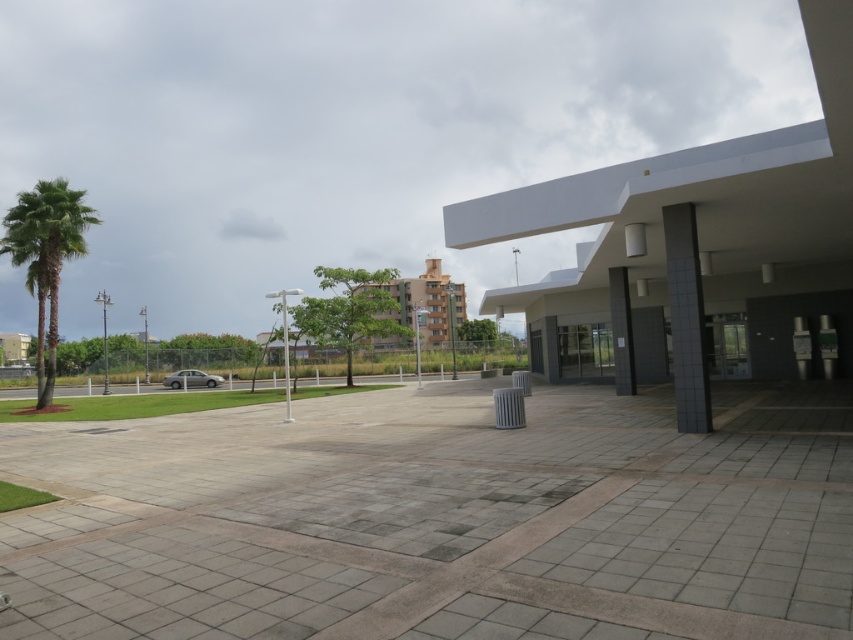
Question: Is green leafy palm tree at left thinner than black tile pillar at right?

Choices:
 (A) no
 (B) yes

Answer: (A)

Question: Which point is closer to the camera taking this photo?

Choices:
 (A) (682, 240)
 (B) (51, 228)
 (C) (614, 385)

Answer: (A)

Question: Can you confirm if green leafy palm tree at left is thinner than black tile pillar at center?

Choices:
 (A) no
 (B) yes

Answer: (A)

Question: Which point is closer to the camera taking this photo?

Choices:
 (A) (611, 288)
 (B) (686, 387)
 (C) (42, 234)

Answer: (B)

Question: Which object is positioned farthest from the black tile pillar at center?

Choices:
 (A) black tile pillar at right
 (B) green leafy palm tree at left

Answer: (B)

Question: Is green leafy palm tree at left below black tile pillar at right?

Choices:
 (A) yes
 (B) no

Answer: (A)